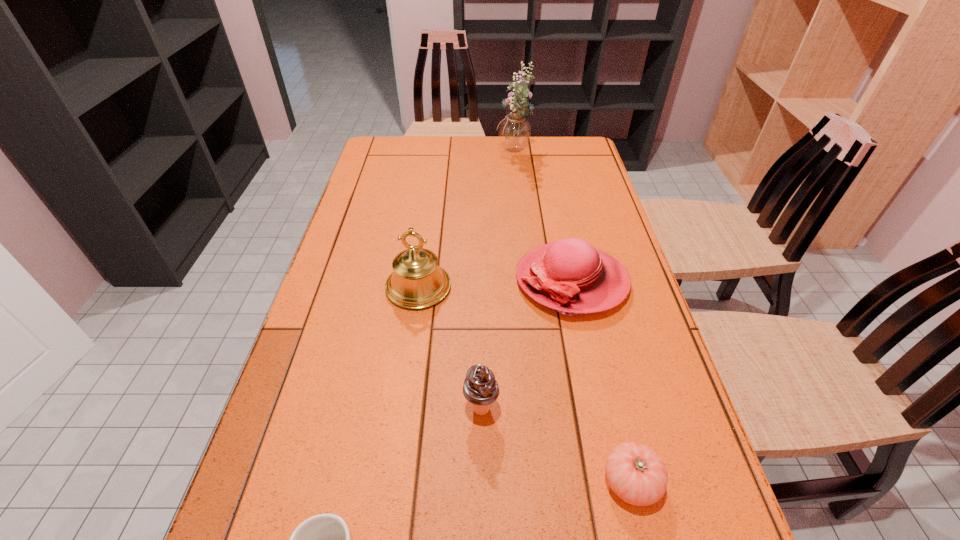
The image size is (960, 540). Find the location of `vacant region that satisfies the following two spatial constraints: 1. at the front of the third shortest object with a bow; 2. on the right side of the second nearest object`. vacant region that satisfies the following two spatial constraints: 1. at the front of the third shortest object with a bow; 2. on the right side of the second nearest object is located at coordinates (614, 482).

Identify the location of free space that satisfies the following two spatial constraints: 1. at the front of the second nearest object with a bow; 2. on the right side of the third shortest object. This screenshot has width=960, height=540. (614, 482).

I want to click on vacant space that satisfies the following two spatial constraints: 1. at the front of the hat with a bow; 2. on the left side of the tomato, so coord(614,482).